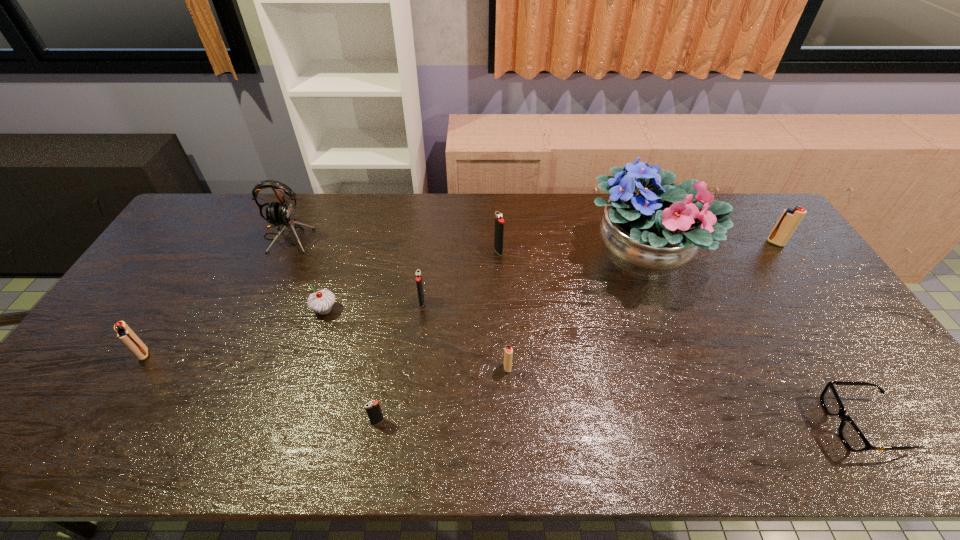
Select which red igniter appears as the closest to the third nearest object. Please provide its 2D coordinates. Your answer should be formatted as a tuple, i.e. [(x, y)], where the tuple contains the x and y coordinates of a point satisfying the conditions above.

[(124, 333)]

You are a GUI agent. You are given a task and a screenshot of the screen. Output one action in this format:
    pyautogui.click(x=<x>, y=<y>)
    Task: Click on the third closest black igniter to the sunglasses
    Image resolution: width=960 pixels, height=540 pixels.
    Given the screenshot: What is the action you would take?
    (373, 410)

Choose which black igniter is the second nearest neighbor to the smallest red igniter. Please provide its 2D coordinates. Your answer should be formatted as a tuple, i.e. [(x, y)], where the tuple contains the x and y coordinates of a point satisfying the conditions above.

[(373, 410)]

Find the location of a particular element. The height and width of the screenshot is (540, 960). blank space that satisfies the following two spatial constraints: 1. on the back side of the leftmost object; 2. on the right side of the rightmost igniter is located at coordinates (214, 243).